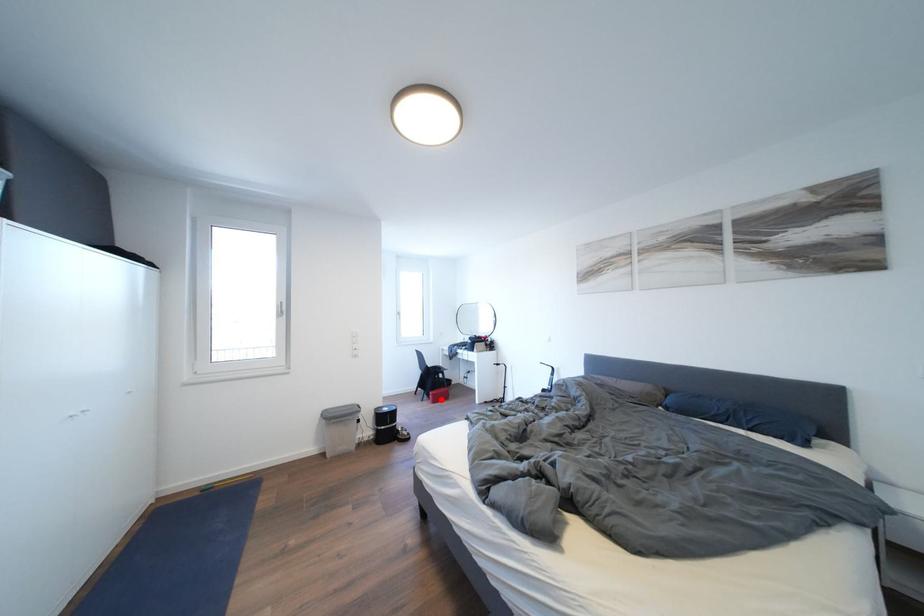
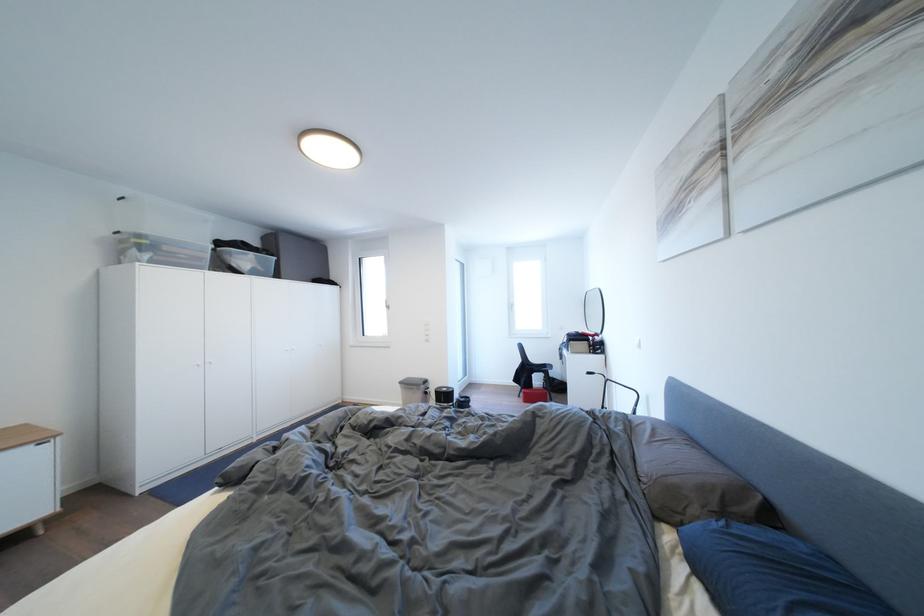
Locate, in the second image, the point that corresponds to the highlighted location in the first image.

(532, 398)